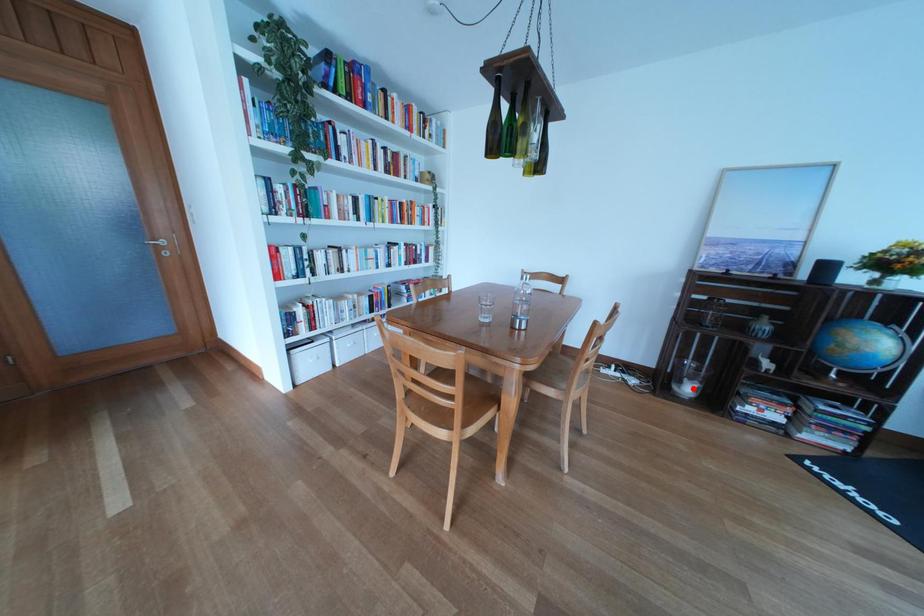
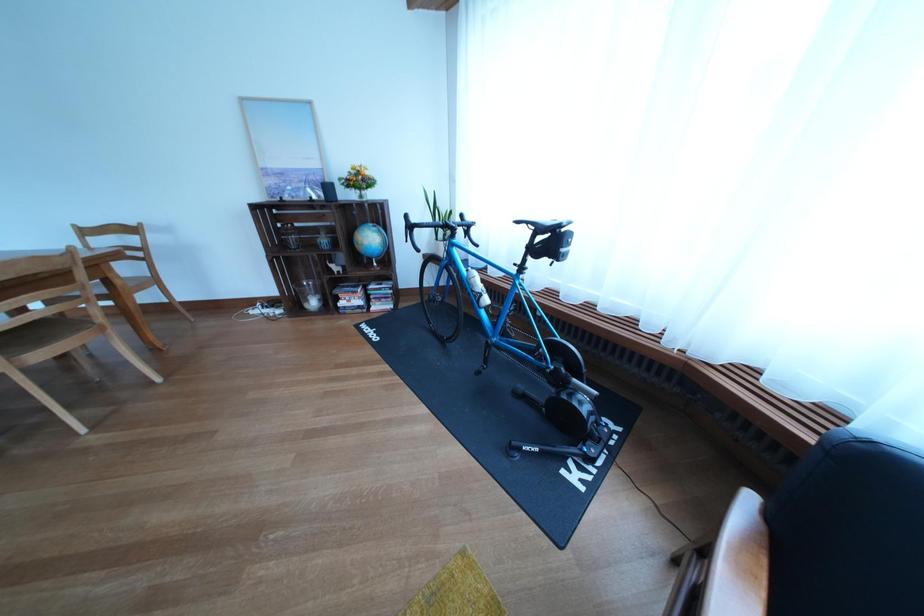
The point at the highlighted location is marked in the first image. Where is the corresponding point in the second image?

(321, 306)